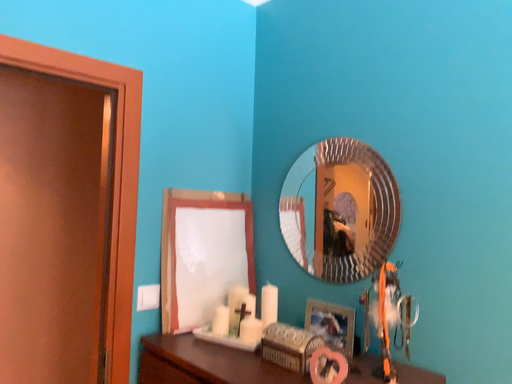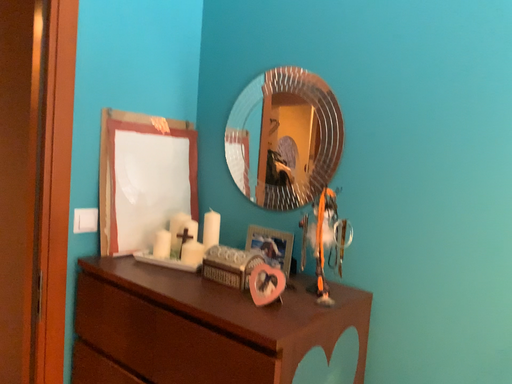
Question: How did the camera likely rotate when shooting the video?

Choices:
 (A) rotated left
 (B) rotated right

Answer: (B)